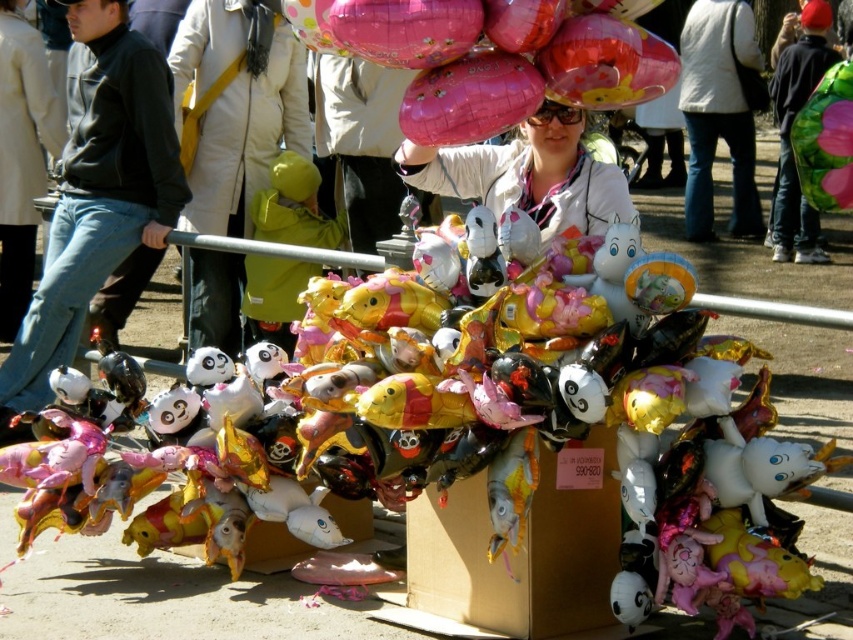
Question: Which point is closer to the camera?

Choices:
 (A) (844, 512)
 (B) (79, 310)

Answer: (A)

Question: Which of the following is the closest to the observer?

Choices:
 (A) pink metallic balloons at center
 (B) matte white jacket at center

Answer: (A)

Question: Can you confirm if metallic gold balloons at center is thinner than gold cardboard box at center?

Choices:
 (A) no
 (B) yes

Answer: (B)

Question: Which object appears farthest from the camera in this image?

Choices:
 (A) gold cardboard box at center
 (B) pink metallic balloon at upper right
 (C) matte white jacket at center
 (D) metallic gold balloon at center

Answer: (C)

Question: In this image, where is metallic gold balloons at center located relative to gold cardboard box at center?

Choices:
 (A) right
 (B) left

Answer: (B)

Question: Is metallic gold balloons at center smaller than gold cardboard box at center?

Choices:
 (A) yes
 (B) no

Answer: (A)